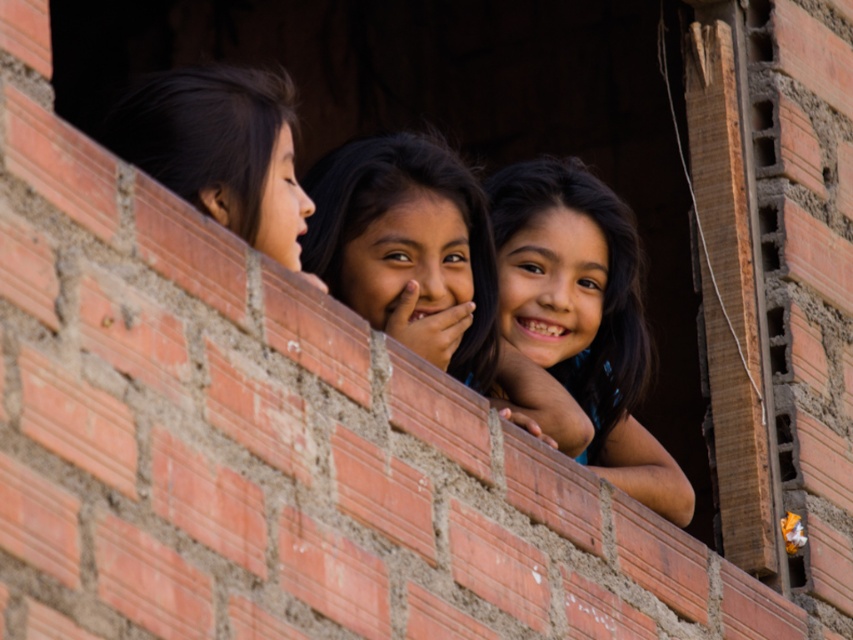
Question: Estimate the real-world distances between objects in this image. Which object is farther from the dark brown hair at center?

Choices:
 (A) black hair at left
 (B) smooth skin child at center

Answer: (A)

Question: Among these points, which one is farthest from the camera?

Choices:
 (A) (245, 184)
 (B) (593, 420)

Answer: (B)

Question: Which of the following is the closest to the observer?

Choices:
 (A) black hair at left
 (B) dark brown hair at center
 (C) smooth skin child at center

Answer: (A)

Question: Can you confirm if smooth skin child at center is bigger than black hair at left?

Choices:
 (A) no
 (B) yes

Answer: (A)

Question: Can you confirm if dark brown hair at center is positioned to the right of black hair at left?

Choices:
 (A) no
 (B) yes

Answer: (B)

Question: Can you confirm if dark brown hair at center is positioned above black hair at left?

Choices:
 (A) yes
 (B) no

Answer: (B)